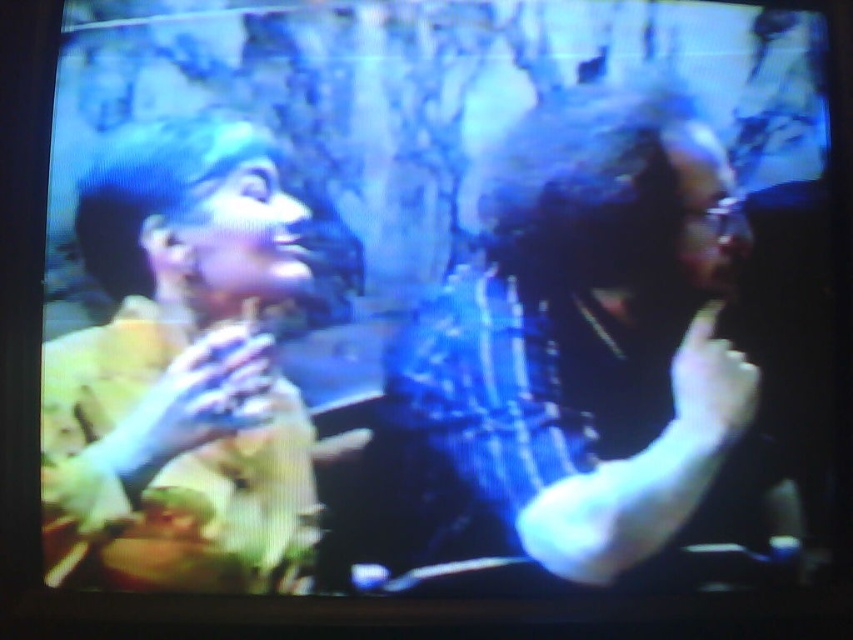
Is matte black shirt at center to the right of yellow fabric at left from the viewer's perspective?

Correct, you'll find matte black shirt at center to the right of yellow fabric at left.

Is point (454, 269) less distant than point (163, 577)?

No, it is behind (163, 577).

Who is more forward, (520,211) or (173,278)?

Point (173,278) is in front.

Locate an element on the screen. matte black shirt at center is located at coordinates (596, 346).